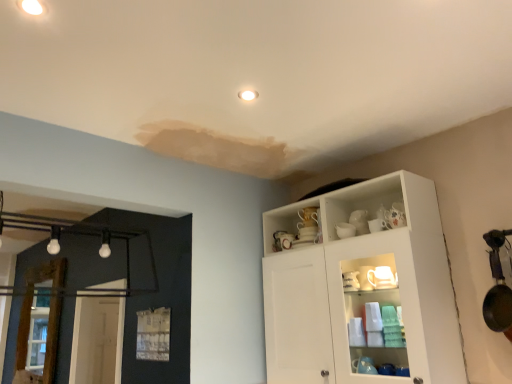
Question: Is wooden screen door at left smaller than white matte cabinet at upper right?

Choices:
 (A) yes
 (B) no

Answer: (A)

Question: Is wooden screen door at left positioned behind white matte cabinet at upper right?

Choices:
 (A) yes
 (B) no

Answer: (A)

Question: Does wooden screen door at left have a lesser width compared to white matte cabinet at upper right?

Choices:
 (A) yes
 (B) no

Answer: (A)

Question: From a real-world perspective, is wooden screen door at left located higher than white matte cabinet at upper right?

Choices:
 (A) no
 (B) yes

Answer: (A)

Question: Can you confirm if wooden screen door at left is taller than white matte cabinet at upper right?

Choices:
 (A) no
 (B) yes

Answer: (A)

Question: Are wooden screen door at left and white matte cabinet at upper right far apart?

Choices:
 (A) no
 (B) yes

Answer: (B)

Question: Can you confirm if white matte cabinet at upper right is positioned to the right of wooden screen door at left?

Choices:
 (A) no
 (B) yes

Answer: (B)

Question: Is white matte cabinet at upper right positioned with its back to wooden screen door at left?

Choices:
 (A) no
 (B) yes

Answer: (A)

Question: Does white matte cabinet at upper right have a lesser height compared to wooden screen door at left?

Choices:
 (A) no
 (B) yes

Answer: (A)

Question: Considering the relative sizes of white matte cabinet at upper right and wooden screen door at left in the image provided, is white matte cabinet at upper right thinner than wooden screen door at left?

Choices:
 (A) yes
 (B) no

Answer: (B)

Question: Does white matte cabinet at upper right appear on the left side of wooden screen door at left?

Choices:
 (A) no
 (B) yes

Answer: (A)

Question: Considering the relative sizes of white matte cabinet at upper right and wooden screen door at left in the image provided, is white matte cabinet at upper right bigger than wooden screen door at left?

Choices:
 (A) no
 (B) yes

Answer: (B)

Question: Is wooden screen door at left bigger or smaller than white matte cabinet at upper right?

Choices:
 (A) small
 (B) big

Answer: (A)